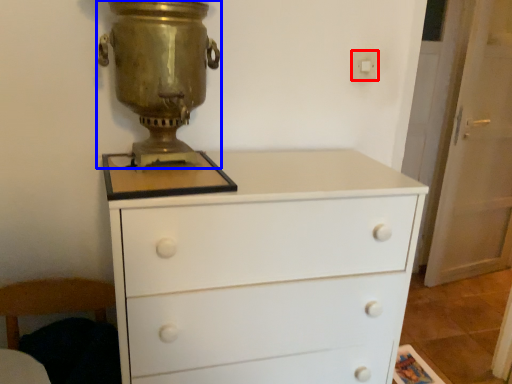
Question: Which object appears farthest to the camera in this image, electric outlet (highlighted by a red box) or candle holder (highlighted by a blue box)?

Choices:
 (A) electric outlet
 (B) candle holder

Answer: (A)